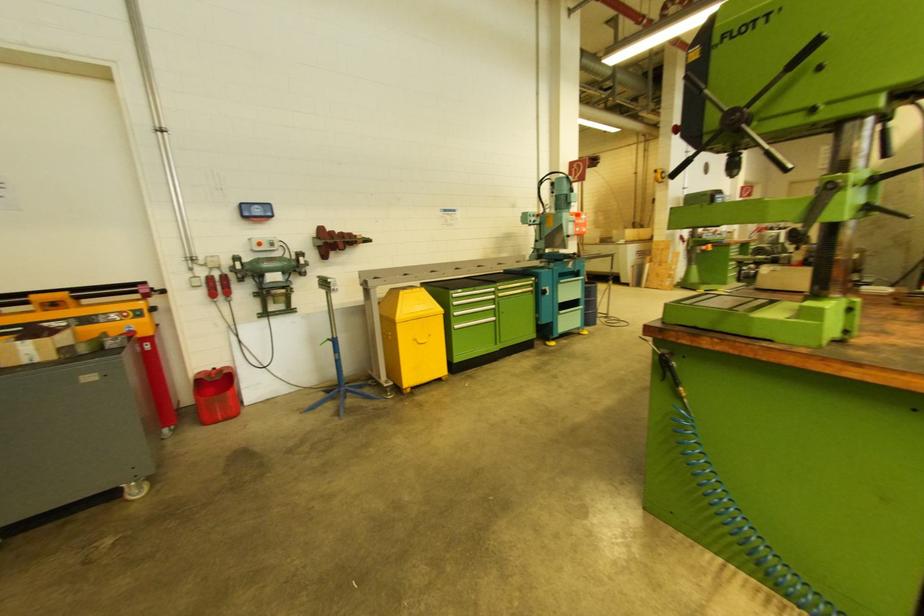
Locate an element on the screen. This screenshot has width=924, height=616. green adjustment lever is located at coordinates (669, 371).